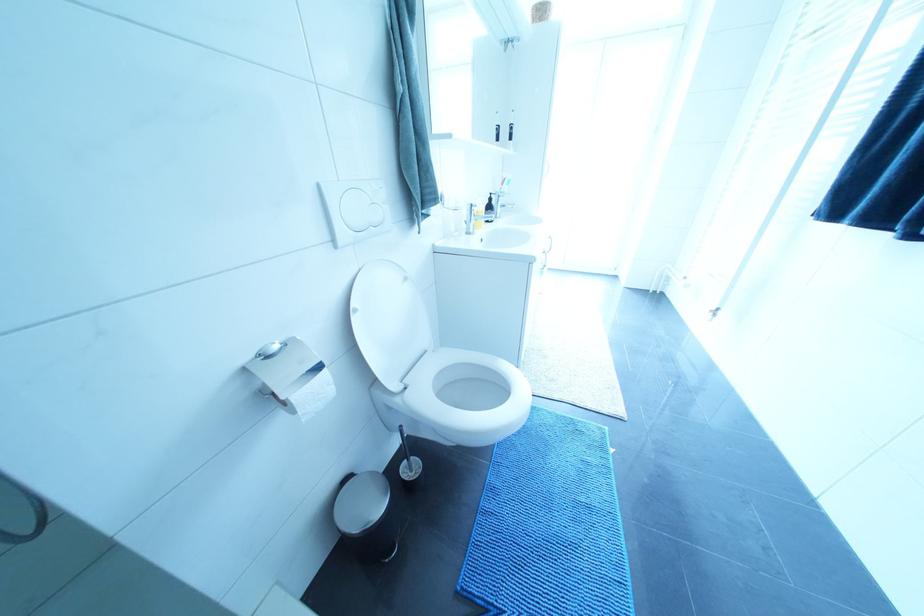
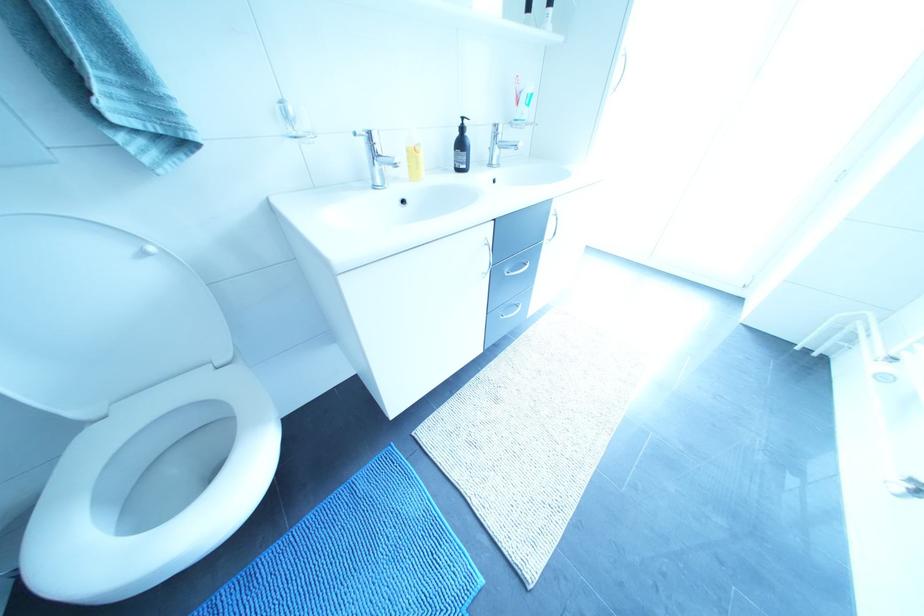
In a continuous first-person perspective shot, in which direction is the camera moving?

The movement direction of the cameraman is right, forward.